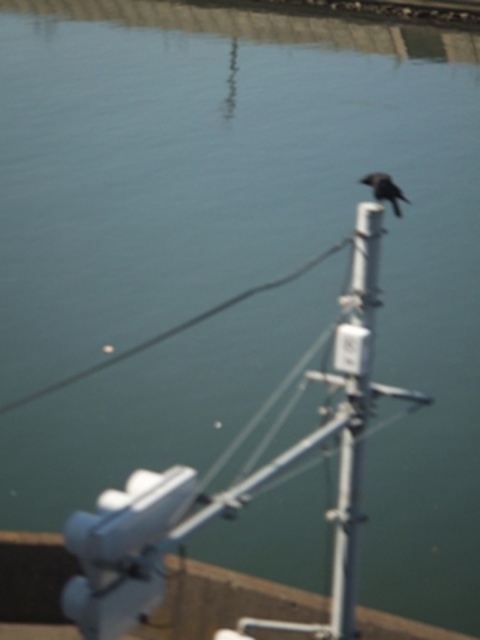
You are a photographer trying to capture both the metallic gray telegraph pole at center and the black matte bird at upper right in the same frame. Which object should you zoom in on to ensure both are clearly visible?

The metallic gray telegraph pole at center is smaller than the black matte bird at upper right, so you should zoom in on the metallic gray telegraph pole at center to ensure both are clearly visible.

You are a photographer trying to capture a clear image of the black matte bird at upper right. However, there is a black wire at center in the scene. Will the wire obstruct your view of the bird?

The black matte bird at upper right is behind the black wire at center, so the wire will obstruct your view of the bird.

You are standing in front of the metal structure with the white cylindrical post and the horizontal arm. You notice two points marked on the structure. One is at coordinate point (205, 314) and the other is at point (383, 179). Which point is closer to you?

Point (205, 314) is further to the viewer than point (383, 179), so the point at (383, 179) is closer to you.